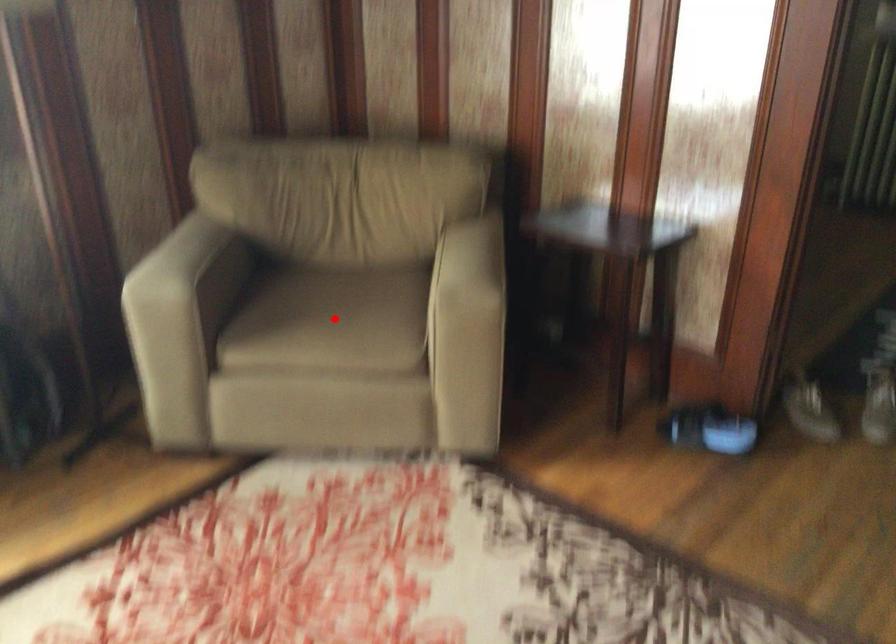
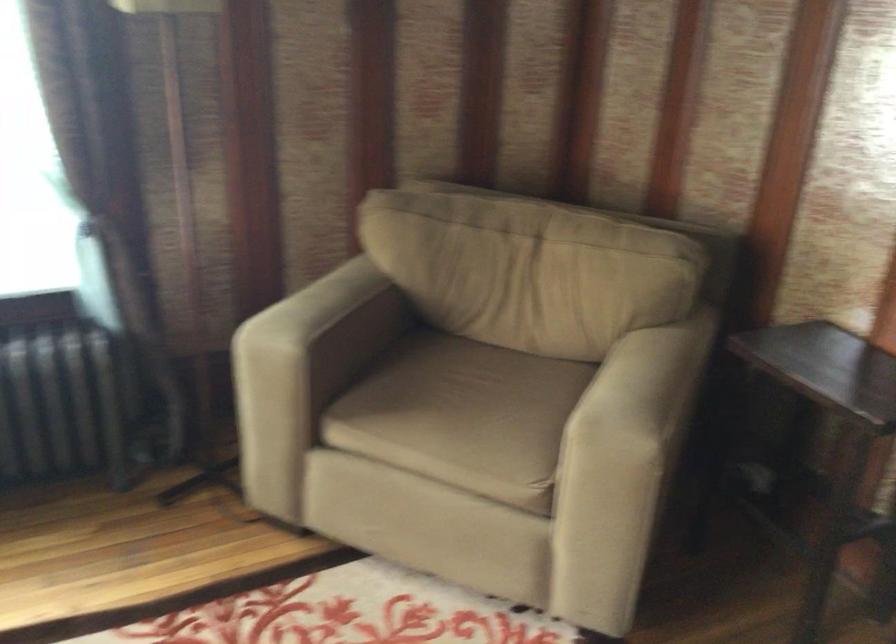
Find the pixel in the second image that matches the highlighted location in the first image.

(458, 413)